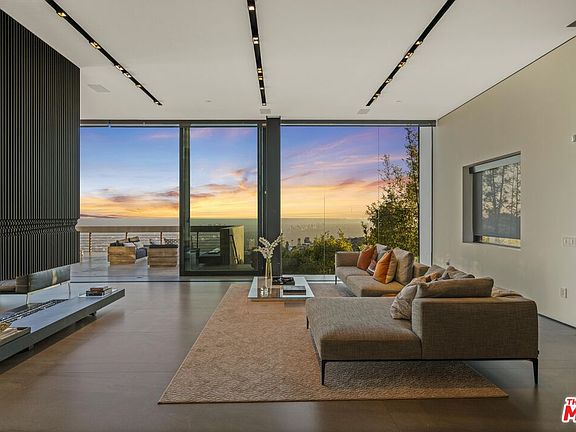
Locate an element on the screen. ceiling is located at coordinates (112, 81), (187, 56), (348, 54), (479, 58).